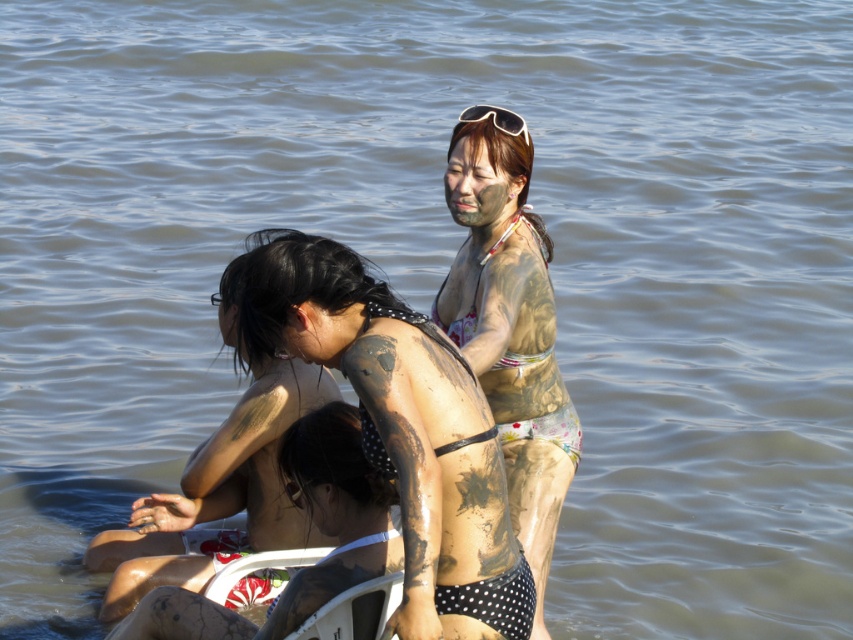
You are a photographer standing at the camera position. You want to take a closeup shot of the matte skin at center. The camera has a minimum focusing distance of 1 meter. Can you take the photo without moving closer?

Yes, because the matte skin at center is 5.05 meters away from the camera, which is beyond the minimum focusing distance of 1 meter, so the camera can focus on it.

You are a photographer standing at the camera position. You want to capture a closeup shot of the muddy skin bikini at upper center. The camera has a minimum focusing distance of 2 meters. Can you take the photo without moving closer?

The muddy skin bikini at upper center is 5.86 meters away from the camera. Since the minimum focusing distance is 2 meters, the photographer can take the closeup shot without moving closer because the distance is within the camera capabilities.